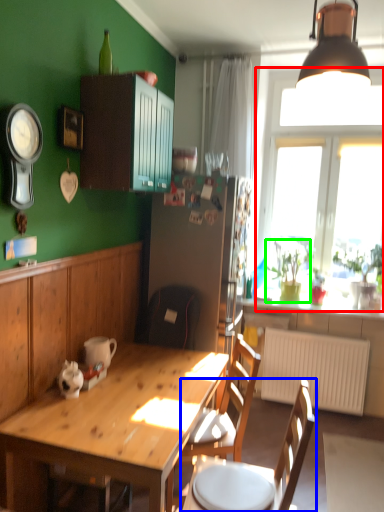
Question: Based on their relative distances, which object is farther from window (highlighted by a red box)? Choose from chair (highlighted by a blue box) and houseplant (highlighted by a green box).

Choices:
 (A) chair
 (B) houseplant

Answer: (A)